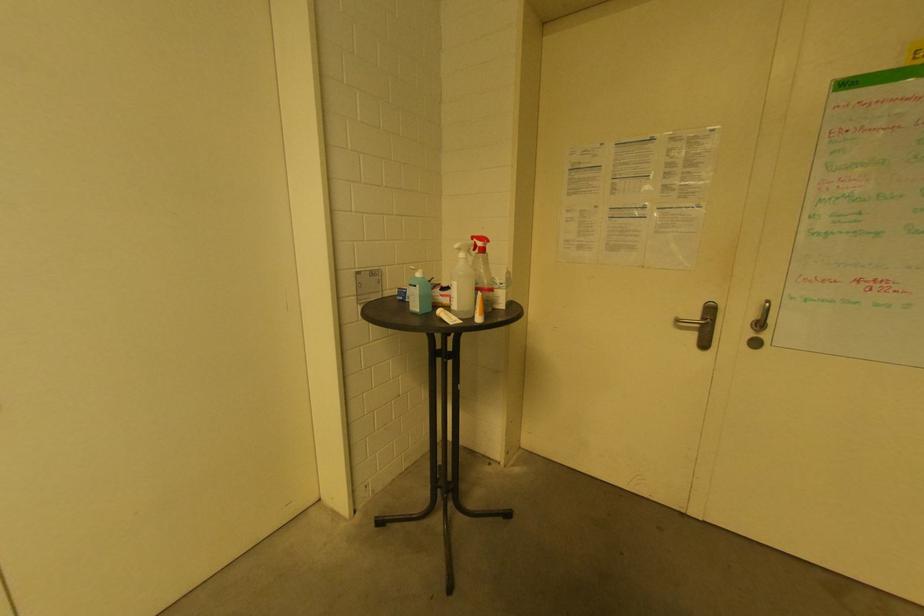
This screenshot has height=616, width=924. Describe the element at coordinates (696, 325) in the screenshot. I see `the silver door handle` at that location.